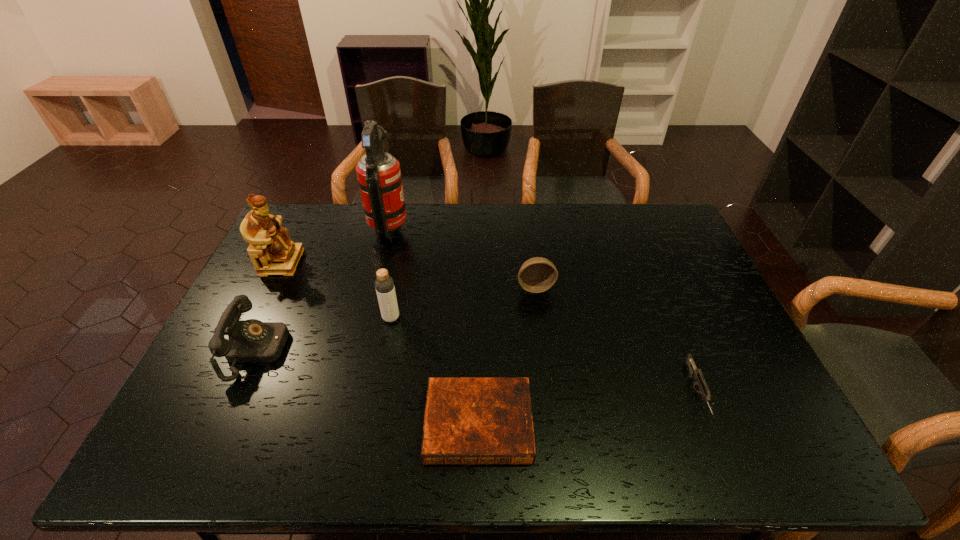
What are the coordinates of `blank space that satisfies the following two spatial constraints: 1. on the front label side of the fire extinguisher; 2. on the right side of the bowl` in the screenshot? It's located at (375, 287).